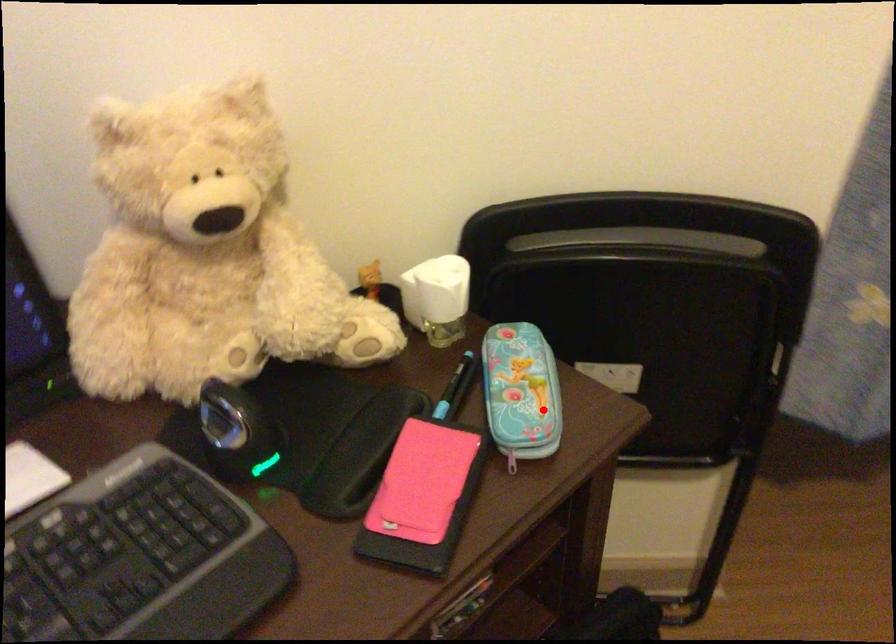
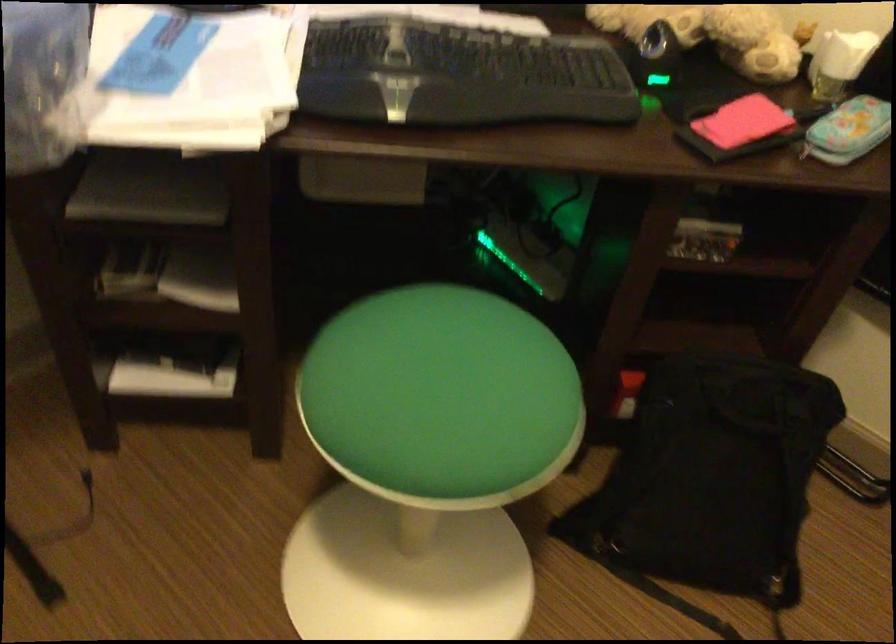
Locate, in the second image, the point that corresponds to the highlighted location in the first image.

(848, 129)